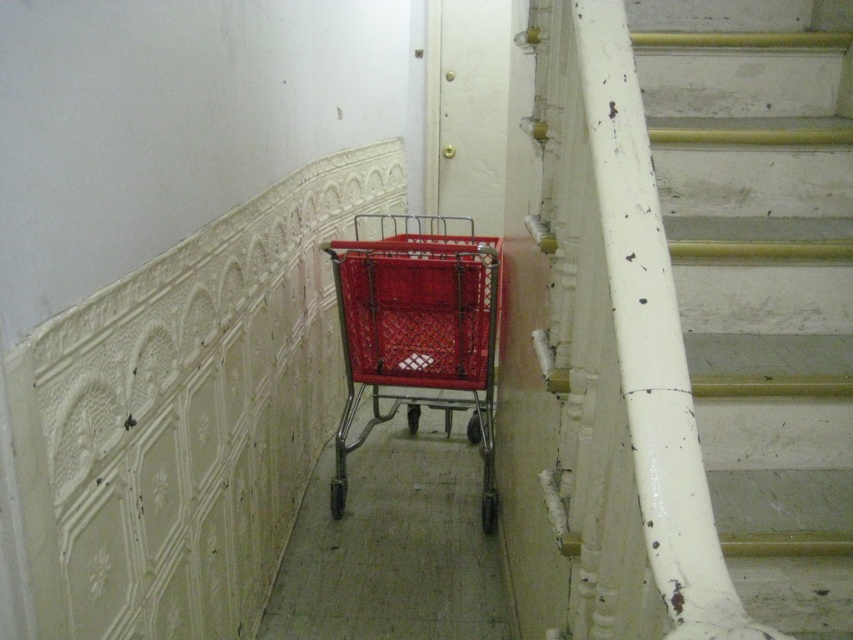
You are standing in the hallway and see the red shopping cart near the center. Where is the white painted wood stairs at right located in relation to the red shopping cart?

The white painted wood stairs at right is located at point (682, 320) in the image, which is to the right of the red shopping cart near the center.

In the scene shown: You are a delivery person trying to push the red plastic shopping cart at center up the white painted wood stairs at right. Based on the scene description, will the shopping cart fit through the staircase?

The white painted wood stairs at right has a greater height compared to the red plastic shopping cart at center, so the shopping cart should be able to fit through the staircase since the stairs are taller than the cart.